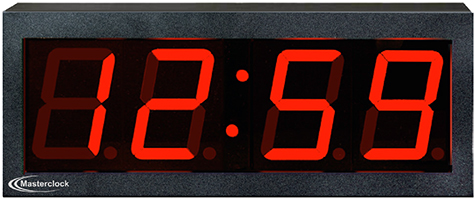
This screenshot has height=200, width=476. What are the coordinates of `light reflections` in the screenshot? It's located at (175, 40), (306, 41), (402, 40), (451, 88).